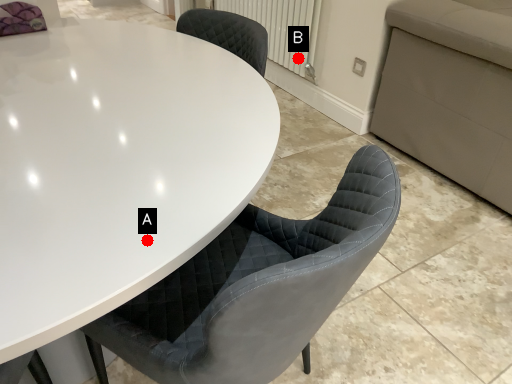
Question: Two points are circled on the image, labeled by A and B beside each circle. Which point is closer to the camera?

Choices:
 (A) A is closer
 (B) B is closer

Answer: (A)